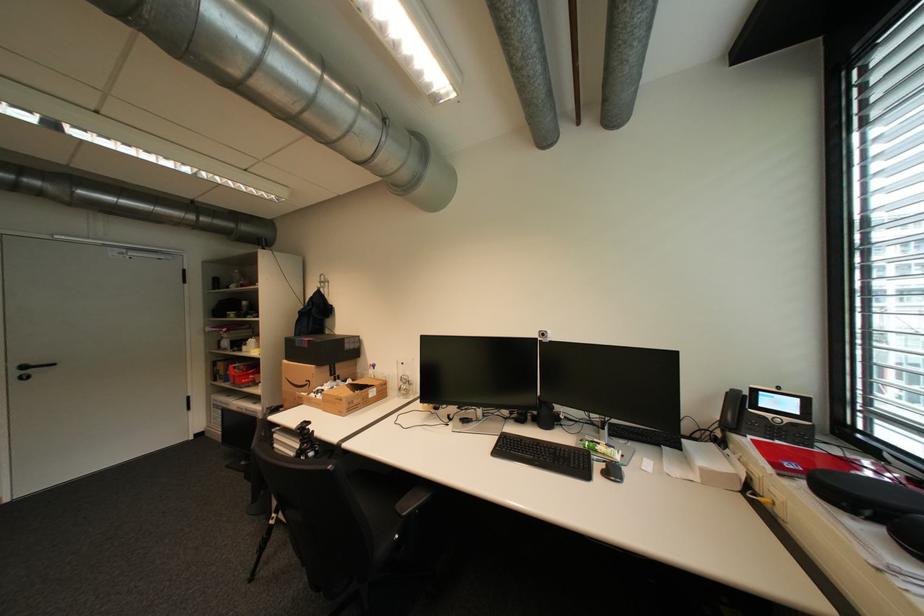
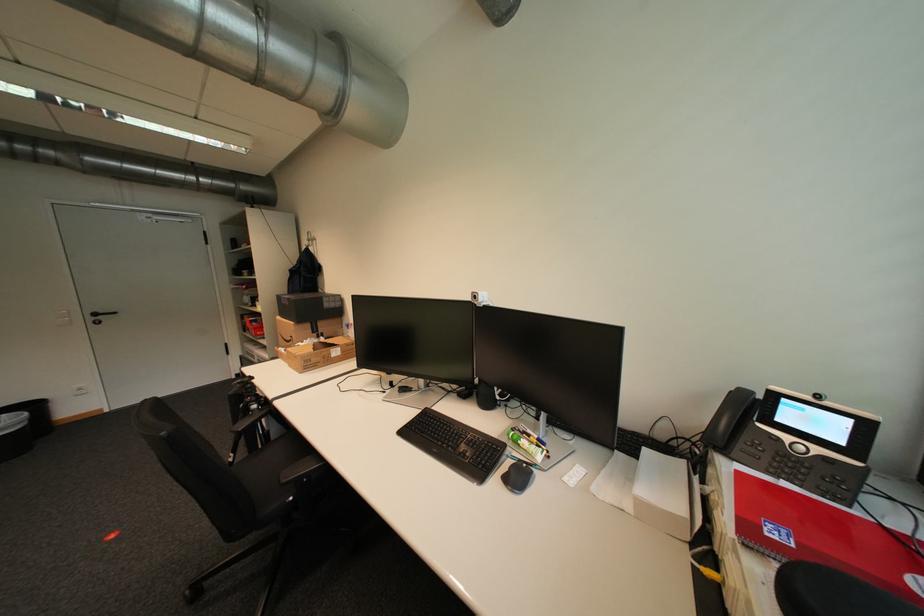
Find the pixel in the second image that matches (32,368) in the first image.

(103, 315)